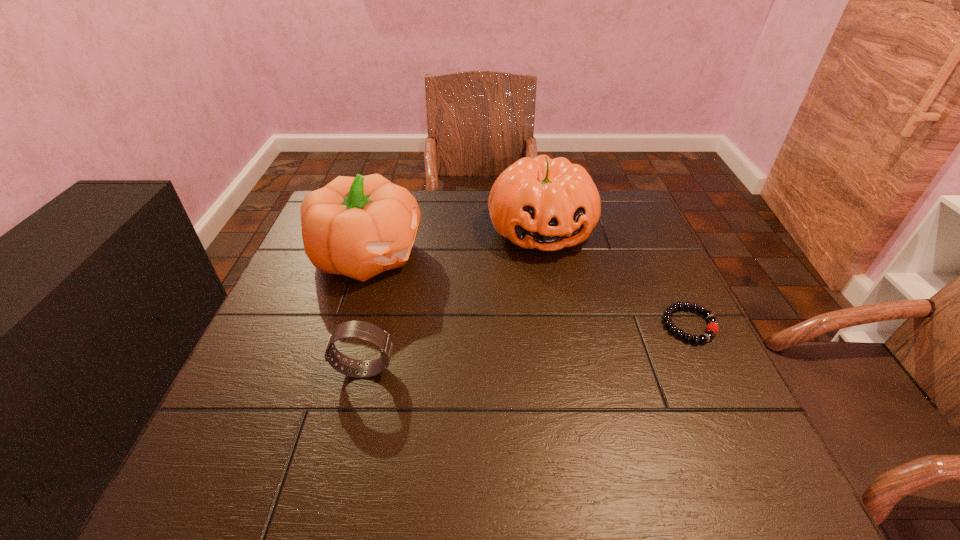
Find the location of a particular element. Image resolution: width=960 pixels, height=540 pixels. the nearest object is located at coordinates (366, 331).

Find the location of a particular element. The image size is (960, 540). watch is located at coordinates (366, 331).

Image resolution: width=960 pixels, height=540 pixels. I want to click on the second nearest object, so click(712, 328).

Where is `the rightmost object`? the rightmost object is located at coordinates (712, 328).

Identify the location of the left pumpkin. This screenshot has height=540, width=960. (358, 227).

Image resolution: width=960 pixels, height=540 pixels. I want to click on the right pumpkin, so coord(548,204).

At what (x,y) coordinates should I click in order to perform the action: click on free space located 0.130m on the face of the third tallest object. Please return your answer as a coordinate pair (x, y). This screenshot has width=960, height=540. Looking at the image, I should click on (460, 369).

At what (x,y) coordinates should I click in order to perform the action: click on vacant area located on the back of the shortest object. Please return your answer as a coordinate pair (x, y). Looking at the image, I should click on [643, 229].

The width and height of the screenshot is (960, 540). Find the location of `vacant region located 0.050m on the carved face of the left pumpkin`. vacant region located 0.050m on the carved face of the left pumpkin is located at coordinates (427, 281).

This screenshot has height=540, width=960. I want to click on free point located on the carved face of the left pumpkin, so click(506, 314).